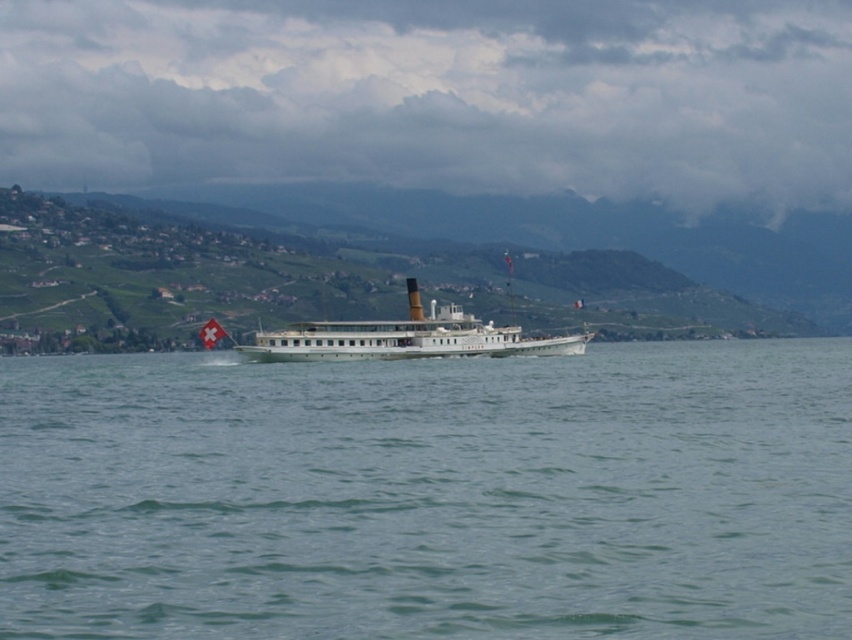
Consider the image. You are a passenger on the white polished wood cruise ship at center and want to see the green water at center. In which direction should you look from your position on the ship?

You should look to your left to see the green water at center, as it is located to the left of the white polished wood cruise ship at center.